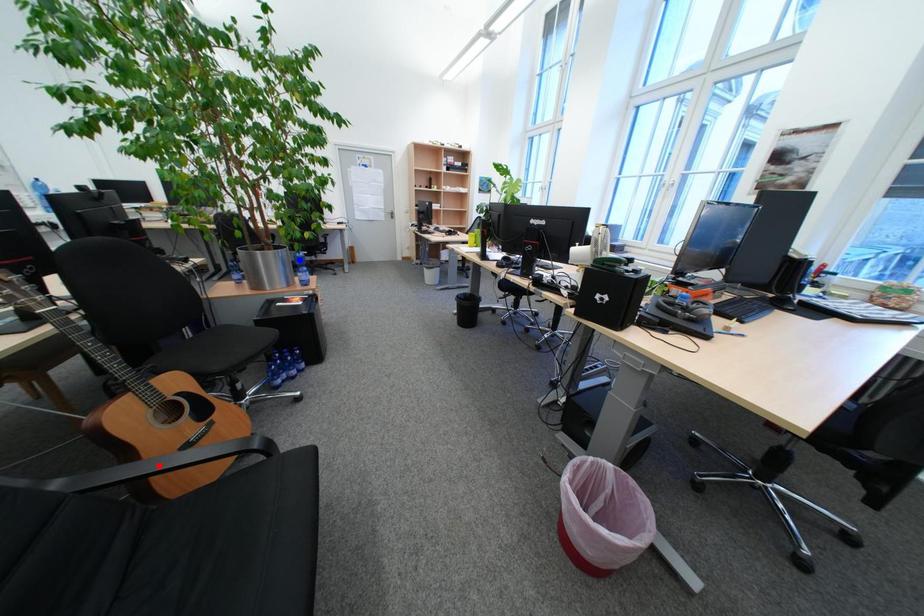
Question: In the image, two points are highlighted. Which point is nearer to the camera? Reply with the corresponding letter.

Choices:
 (A) blue point
 (B) red point

Answer: (B)